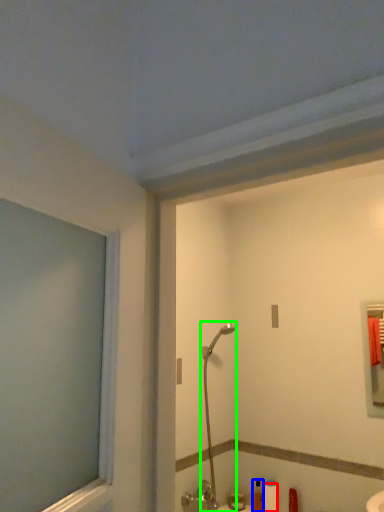
Question: Which is farther away from toilet paper (highlighted by a red box)? toiletry (highlighted by a blue box) or shower (highlighted by a green box)?

Choices:
 (A) toiletry
 (B) shower

Answer: (B)